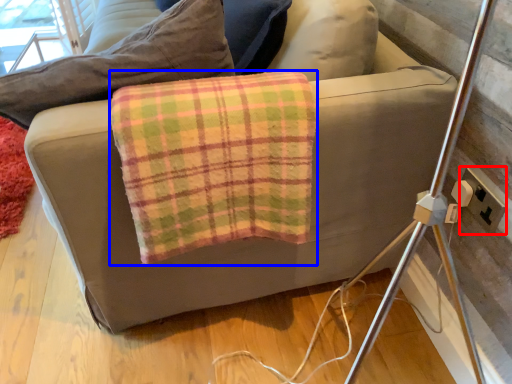
Question: Which point is closer to the camera, electric outlet (highlighted by a red box) or material (highlighted by a blue box)?

Choices:
 (A) electric outlet
 (B) material

Answer: (B)